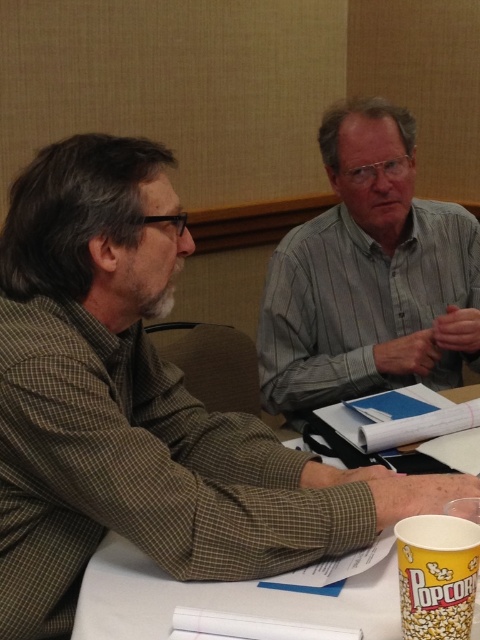
Question: Which point is closer to the camera?

Choices:
 (A) (361, 580)
 (B) (405, 582)
 (C) (398, 273)

Answer: (B)

Question: In this image, where is gray striped shirt at upper right located relative to white paper at center?

Choices:
 (A) below
 (B) above

Answer: (B)

Question: Estimate the real-world distances between objects in this image. Which object is farther from the gray striped shirt at upper right?

Choices:
 (A) yellow paper cup at lower right
 (B) white paper at center

Answer: (A)

Question: Estimate the real-world distances between objects in this image. Which object is farther from the gray striped shirt at upper right?

Choices:
 (A) yellow paper cup at lower right
 (B) white paper at center

Answer: (A)

Question: Is gray striped shirt at upper right below yellow paper cup at lower right?

Choices:
 (A) no
 (B) yes

Answer: (A)

Question: Does gray striped shirt at upper right appear under white paper at center?

Choices:
 (A) no
 (B) yes

Answer: (A)